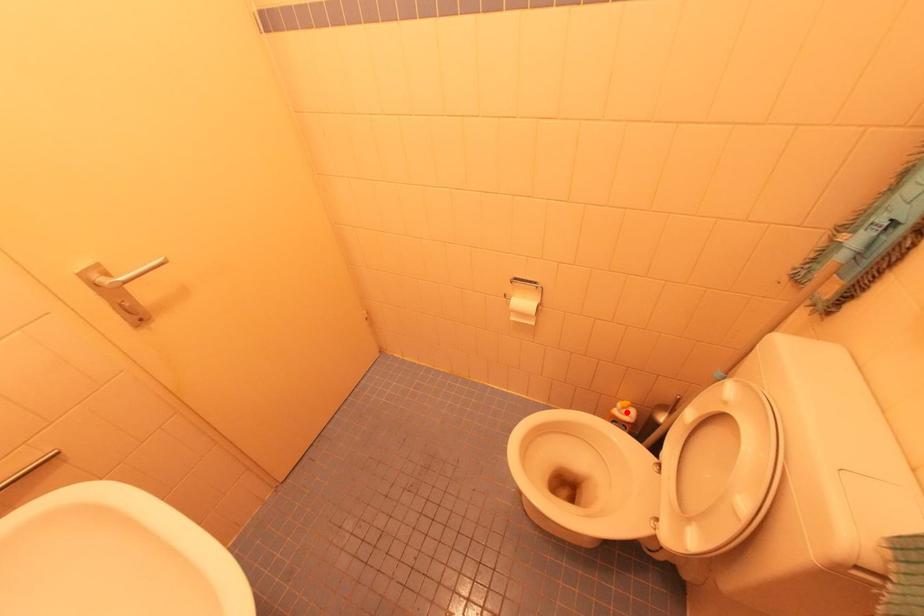
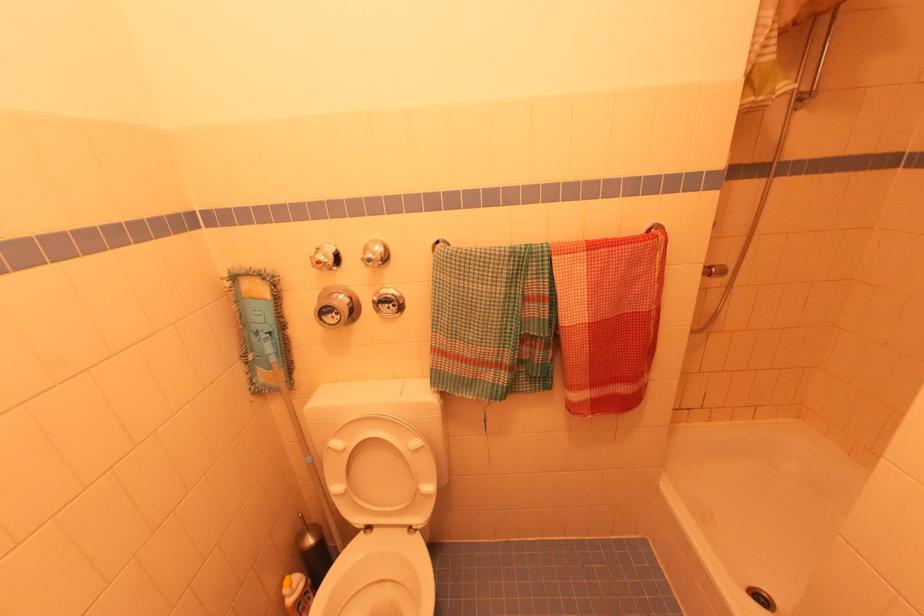
The point at the highlighted location is marked in the first image. Where is the corresponding point in the second image?

(296, 585)